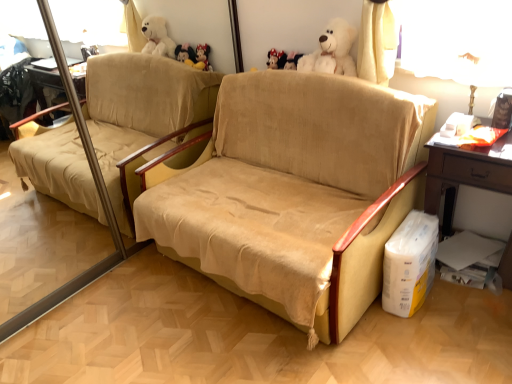
Question: Looking at their shapes, would you say wooden table at right is wider or thinner than white cardboard box at lower right?

Choices:
 (A) wide
 (B) thin

Answer: (A)

Question: Is wooden table at right situated inside white cardboard box at lower right or outside?

Choices:
 (A) inside
 (B) outside

Answer: (B)

Question: Estimate the real-world distances between objects in this image. Which object is farther from the wooden table at right?

Choices:
 (A) white cardboard box at lower right
 (B) metallic gold table lamp at upper right
 (C) beige suede couch at center
 (D) fluffy white teddy bear at upper center

Answer: (D)

Question: Estimate the real-world distances between objects in this image. Which object is closer to the white cardboard box at lower right?

Choices:
 (A) beige suede couch at center
 (B) metallic gold table lamp at upper right
 (C) fluffy white teddy bear at upper center
 (D) wooden table at right

Answer: (D)